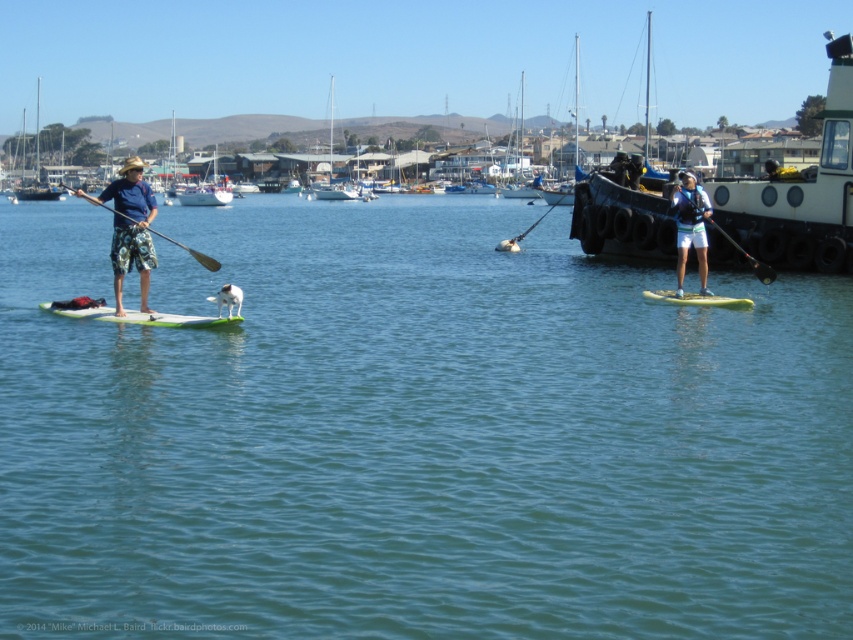
You are a photographer planning to take a photo of the wooden sailboat at upper left and the black rubber paddle at center. Based on their positions, which object should you focus on first to ensure both are in frame?

The wooden sailboat at upper left is positioned on the left side of the black rubber paddle at center, so you should focus on the wooden sailboat at upper left first to ensure both are in frame.

You are navigating a small boat in the marina and need to pass between the two points marked as point (x=747, y=237) and point (x=753, y=262). Which point should you steer towards first to maintain the correct path?

You should steer towards point (x=753, y=262) first because point (x=747, y=237) is behind it, so approaching the closer point first ensures proper navigation between them.

You are a photographer trying to capture both the camouflage shorts at left and the blue fabric shirt at center in the same frame. Since you want to ensure both are visible, which clothing item should you focus on first to avoid blurriness due to their height difference?

The camouflage shorts at left is taller than the blue fabric shirt at center, so you should focus on the camouflage shorts at left first to ensure it is in focus before the shorter blue fabric shirt at center.